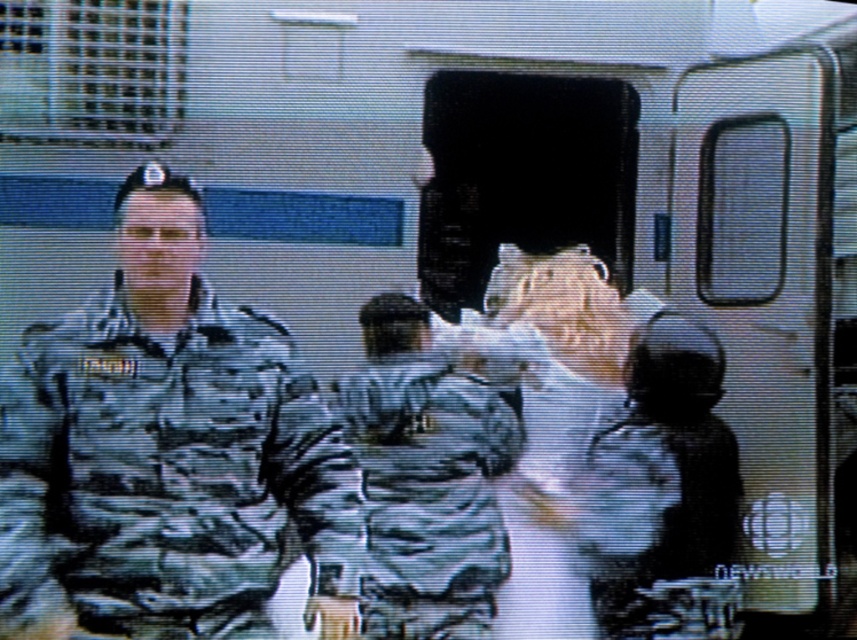
Does camo uniform at center lie in front of camouflage fabric uniform at center?

Yes, it is.

Is point (213, 588) positioned in front of point (387, 369)?

Yes.

Between point (148, 410) and point (388, 532), which one is positioned in front?

Point (148, 410) is in front.

What are the coordinates of `camo uniform at center` in the screenshot? It's located at pyautogui.click(x=166, y=451).

Identify the location of camo uniform at center. (166, 451).

The image size is (857, 640). Describe the element at coordinates (166, 451) in the screenshot. I see `camo uniform at center` at that location.

The height and width of the screenshot is (640, 857). Identify the location of camo uniform at center. (166, 451).

Can you confirm if camouflage fabric uniform at center is taller than camouflage fabric uniform at lower right?

Correct, camouflage fabric uniform at center is much taller as camouflage fabric uniform at lower right.

Does camouflage fabric uniform at center appear on the left side of camouflage fabric uniform at lower right?

Correct, you'll find camouflage fabric uniform at center to the left of camouflage fabric uniform at lower right.

Between point (468, 577) and point (634, 513), which one is positioned in front?

Positioned in front is point (468, 577).

The image size is (857, 640). In order to click on camouflage fabric uniform at center in this screenshot , I will do `click(428, 493)`.